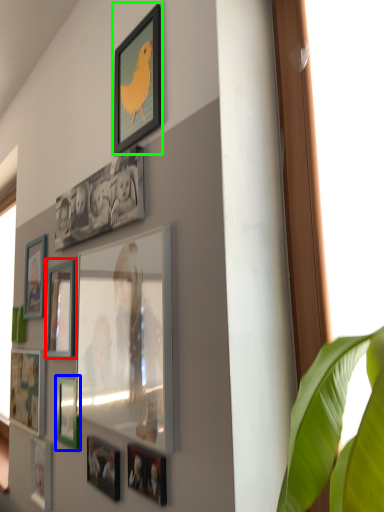
Question: Based on their relative distances, which object is farther from picture frame (highlighted by a red box)? Choose from picture frame (highlighted by a blue box) and picture frame (highlighted by a green box).

Choices:
 (A) picture frame
 (B) picture frame

Answer: (B)